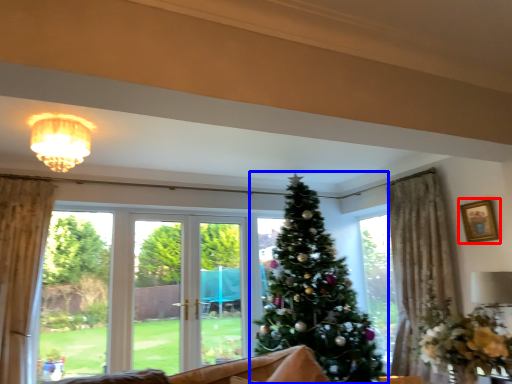
Question: Which object appears farthest to the camera in this image, picture frame (highlighted by a red box) or christmas tree (highlighted by a blue box)?

Choices:
 (A) picture frame
 (B) christmas tree

Answer: (A)